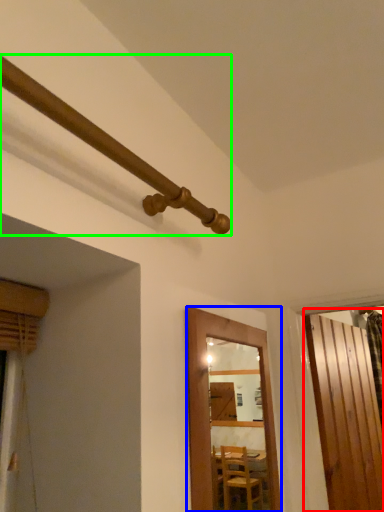
Question: Based on their relative distances, which object is farther from door (highlighted by a red box)? Choose from door (highlighted by a blue box) and pipe (highlighted by a green box).

Choices:
 (A) door
 (B) pipe

Answer: (B)